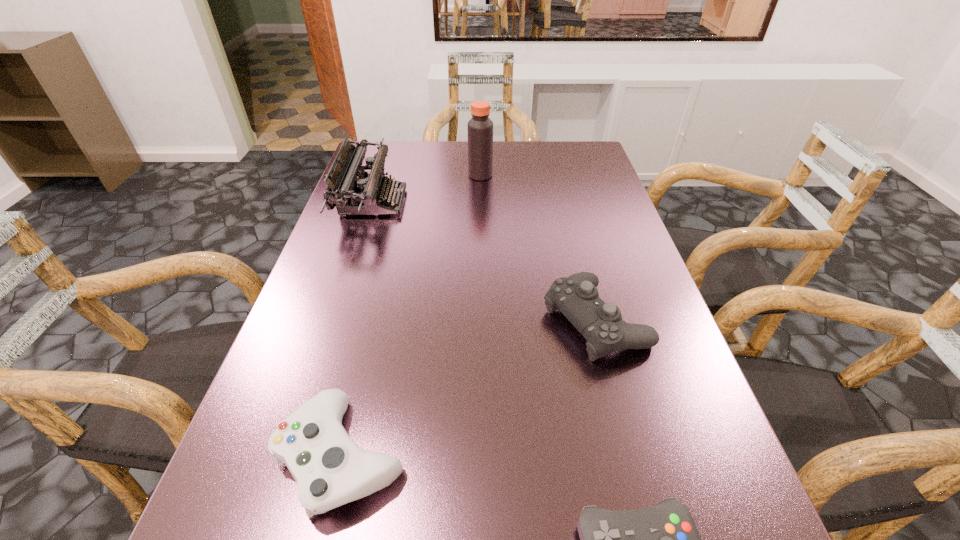
I want to click on vinegar at the far edge, so click(x=480, y=127).

Identify the location of typewriter that is at the far edge. The width and height of the screenshot is (960, 540). (352, 196).

Where is `typewriter that is positioned at the left edge`? The height and width of the screenshot is (540, 960). typewriter that is positioned at the left edge is located at coordinates (352, 196).

Locate an element on the screen. The height and width of the screenshot is (540, 960). control at the left edge is located at coordinates (330, 469).

The width and height of the screenshot is (960, 540). In order to click on object at the right edge in this screenshot , I will do `click(576, 297)`.

Identify the location of object situated at the far left corner. (352, 196).

I want to click on vacant position at the far edge of the desktop, so click(494, 155).

Locate an element on the screen. This screenshot has width=960, height=540. vacant space at the left edge of the desktop is located at coordinates (380, 276).

The width and height of the screenshot is (960, 540). In the image, there is a desktop. What are the coordinates of `vacant space at the right edge` in the screenshot? It's located at (611, 417).

Identify the location of vacant space at the far left corner. (395, 156).